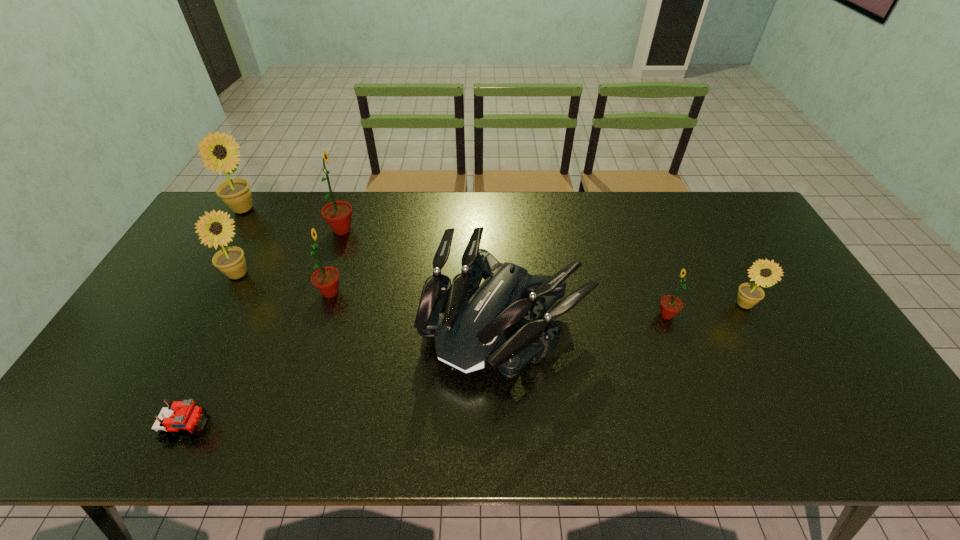
Where is `vacant space at the near left corner`? This screenshot has height=540, width=960. vacant space at the near left corner is located at coordinates (99, 446).

Image resolution: width=960 pixels, height=540 pixels. Find the location of `free area in between the second smallest green sunflower and the leftmost sunflower`. free area in between the second smallest green sunflower and the leftmost sunflower is located at coordinates (287, 251).

I want to click on free area in between the farthest green sunflower and the second yellow sunflower from right to left, so click(290, 252).

The height and width of the screenshot is (540, 960). Identify the location of free space between the sixth object from left to right and the second smallest yellow sunflower. (372, 298).

Where is `vacant space that's between the second farthest yellow sunflower and the sixth object from left to right`? The height and width of the screenshot is (540, 960). vacant space that's between the second farthest yellow sunflower and the sixth object from left to right is located at coordinates (372, 298).

At what (x,y) coordinates should I click in order to perform the action: click on vacant region between the shortest object and the third object from right to left. Please return your answer as a coordinate pair (x, y). Image resolution: width=960 pixels, height=540 pixels. Looking at the image, I should click on (347, 375).

This screenshot has height=540, width=960. Find the location of `free space between the drone and the farthest green sunflower`. free space between the drone and the farthest green sunflower is located at coordinates (424, 275).

Select which object appears as the second closest to the second farthest green sunflower. Please provide its 2D coordinates. Your answer should be formatted as a tuple, i.e. [(x, y)], where the tuple contains the x and y coordinates of a point satisfying the conditions above.

[(230, 260)]

Select which object is the fourth closest to the leftmost sunflower. Please provide its 2D coordinates. Your answer should be formatted as a tuple, i.e. [(x, y)], where the tuple contains the x and y coordinates of a point satisfying the conditions above.

[(472, 332)]

Point out which sunflower is positioned as the nearest to the fifth sunflower from left to right. Please provide its 2D coordinates. Your answer should be formatted as a tuple, i.e. [(x, y)], where the tuple contains the x and y coordinates of a point satisfying the conditions above.

[(749, 294)]